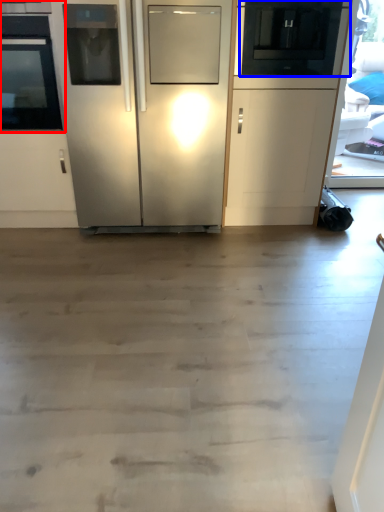
Question: Which point is further to the camera, oven (highlighted by a red box) or appliance (highlighted by a blue box)?

Choices:
 (A) oven
 (B) appliance

Answer: (B)